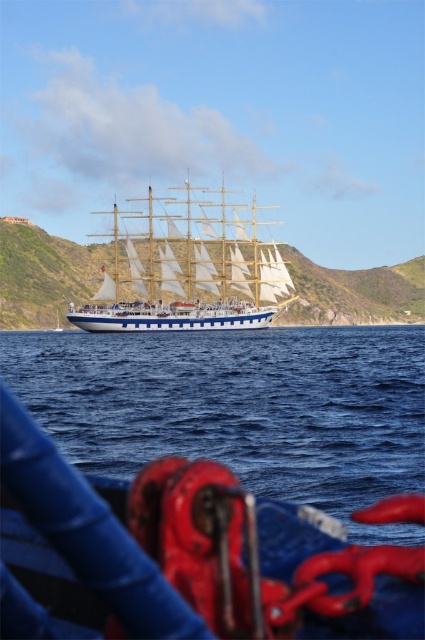
Can you confirm if blue water at center is wider than white wooden ship at center?

Yes.

Is blue water at center taller than white wooden ship at center?

Incorrect, blue water at center's height is not larger of white wooden ship at center's.

What do you see at coordinates (240, 406) in the screenshot? The image size is (425, 640). I see `blue water at center` at bounding box center [240, 406].

In order to click on blue water at center in this screenshot , I will do `click(240, 406)`.